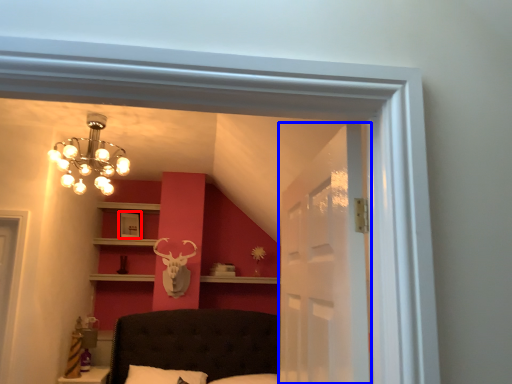
Question: Which point is closer to the camera, picture frame (highlighted by a red box) or glass door (highlighted by a blue box)?

Choices:
 (A) picture frame
 (B) glass door

Answer: (B)